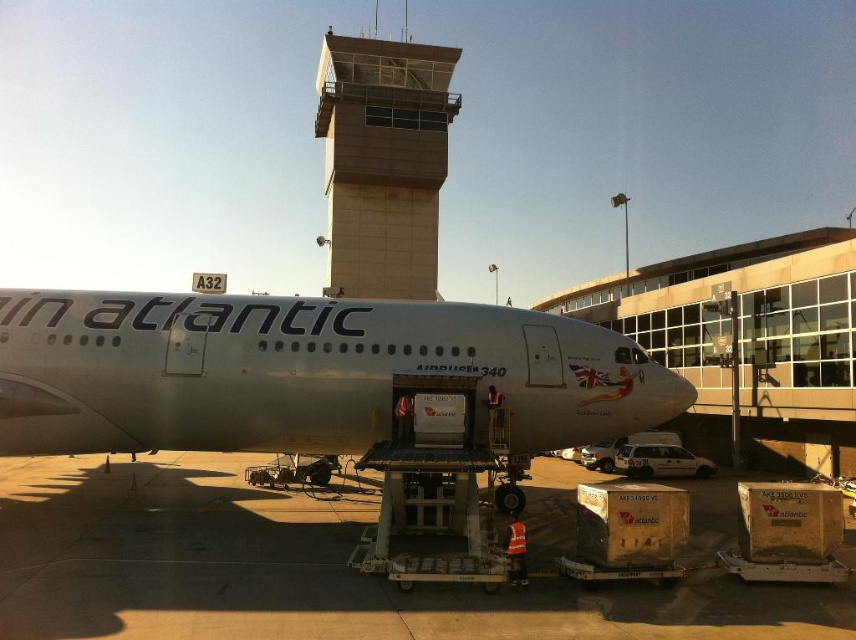
Is point (655, 616) positioned before point (421, 273)?

Yes, it is.

Who is more forward, (241, 609) or (345, 99)?

Positioned in front is point (241, 609).

Is point (99, 544) less distant than point (373, 250)?

Yes, point (99, 544) is in front of point (373, 250).

This screenshot has width=856, height=640. What are the coordinates of `white glossy tarmac at lower center` in the screenshot? It's located at (306, 572).

Based on the photo, can you confirm if white glossy tarmac at lower center is shorter than white glossy airplane at center?

Yes.

Can you confirm if white glossy tarmac at lower center is positioned below white glossy airplane at center?

Yes, white glossy tarmac at lower center is below white glossy airplane at center.

Is point (126, 476) more distant than point (516, 426)?

Yes, point (126, 476) is behind point (516, 426).

At what (x,y) coordinates should I click in order to perform the action: click on white glossy tarmac at lower center. Please return your answer as a coordinate pair (x, y). Image resolution: width=856 pixels, height=640 pixels. Looking at the image, I should click on (306, 572).

Between white glossy airplane at center and beige concrete control tower at upper center, which one has more height?

beige concrete control tower at upper center

Between white glossy airplane at center and beige concrete control tower at upper center, which one appears on the right side from the viewer's perspective?

Positioned to the right is white glossy airplane at center.

Is point (550, 323) more distant than point (453, 64)?

No, (550, 323) is in front of (453, 64).

Where is `white glossy airplane at center`? Image resolution: width=856 pixels, height=640 pixels. white glossy airplane at center is located at coordinates (301, 371).